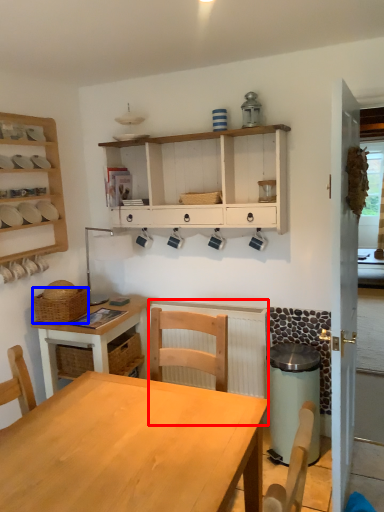
Question: Which object appears closest to the camera in this image, radiator (highlighted by a red box) or basket (highlighted by a blue box)?

Choices:
 (A) radiator
 (B) basket

Answer: (B)